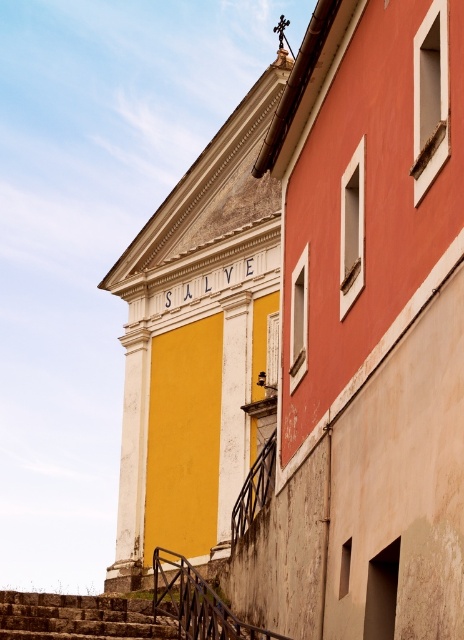
You are standing in front of the building and want to walk towards the black metal railing at lower center and the black wrought iron railing at lower center. Which one will you reach first?

You will reach the black metal railing at lower center first because it is closer to the viewer than the black wrought iron railing at lower center.

You are standing in front of the building and want to know which of the two points, point (212, 602) or point (251, 484), is closer to you. Based on the image, which point is nearer?

Point (212, 602) is closer to the camera than point (251, 484), so it is the nearer one.

You are standing in front of the building and want to locate the yellow matte wall at center. What are the coordinates where you should look to find it?

The yellow matte wall at center is located at coordinates point (199, 344).